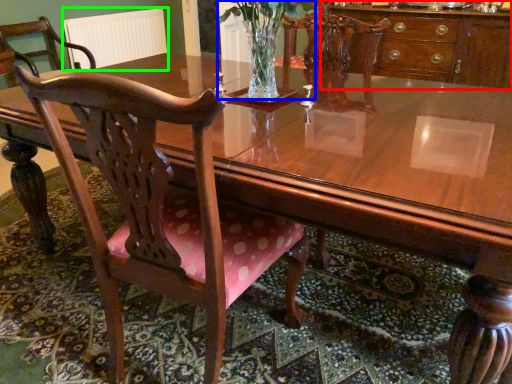
Question: Which object is the farthest from cabinetry (highlighted by a red box)? Choose among these: floral arrangement (highlighted by a blue box) or radiator (highlighted by a green box).

Choices:
 (A) floral arrangement
 (B) radiator

Answer: (B)